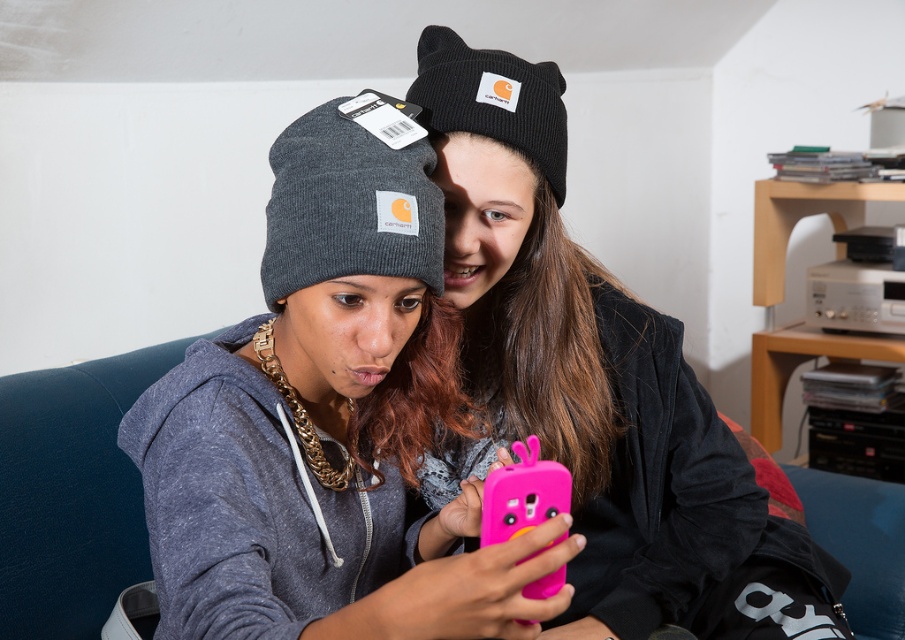
Describe the element at coordinates (592, 371) in the screenshot. This screenshot has width=905, height=640. I see `matte black beanie at center` at that location.

Is point (538, 180) positioned behind point (541, 490)?

Yes, point (538, 180) is farther from viewer.

Between point (511, 124) and point (515, 449), which one is positioned behind?

Positioned behind is point (511, 124).

Locate an element on the screen. The height and width of the screenshot is (640, 905). matte black beanie at center is located at coordinates (592, 371).

Who is more distant from viewer, (167, 509) or (452, 243)?

The point (452, 243) is behind.

The height and width of the screenshot is (640, 905). I want to click on matte gray beanie at center, so click(x=319, y=428).

Measure the distance between point (286, 189) and camera.

78.79 centimeters

Is matte gray beanie at center taller than pink rubber phone case at center?

Yes, matte gray beanie at center is taller than pink rubber phone case at center.

Where is `matte gray beanie at center`? matte gray beanie at center is located at coordinates (319, 428).

The height and width of the screenshot is (640, 905). Identify the location of matte gray beanie at center. (319, 428).